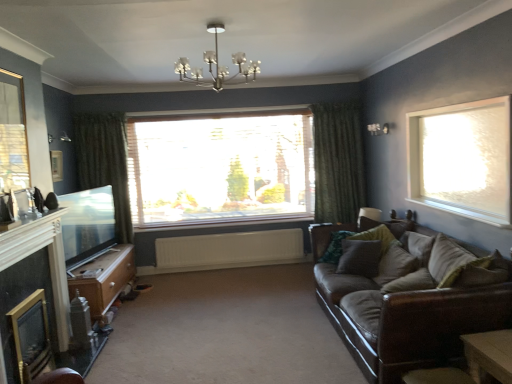
At what (x,y) coordinates should I click in order to perform the action: click on beige fabric pillow at right, which is the 3th pillow in back-to-front order. Please return your answer as a coordinate pair (x, y). Looking at the image, I should click on (395, 264).

The width and height of the screenshot is (512, 384). Describe the element at coordinates (87, 222) in the screenshot. I see `flat screen tv at left, the second window screen in the top-to-bottom sequence` at that location.

This screenshot has height=384, width=512. In order to click on frosted glass window at upper right, the second window from the left in this screenshot , I will do `click(462, 159)`.

Locate an element on the screen. This screenshot has height=384, width=512. wooden picture frame at upper left is located at coordinates (56, 165).

The image size is (512, 384). Find the location of `velvet green pillow at right, the first pillow when ordered from front to back`. velvet green pillow at right, the first pillow when ordered from front to back is located at coordinates (449, 261).

Based on the photo, is dark gray textured pillow at center right, acting as the 3th pillow starting from the front, closer to the viewer compared to green textured curtain at center, the 1th curtain when ordered from right to left?

Yes, dark gray textured pillow at center right, acting as the 3th pillow starting from the front, is in front of green textured curtain at center, the 1th curtain when ordered from right to left.

Is point (369, 274) more distant than point (345, 160)?

That is False.

Could you tell me if dark gray textured pillow at center right, acting as the 3th pillow starting from the front, is turned towards green textured curtain at center, the second curtain from the left?

No, dark gray textured pillow at center right, acting as the 3th pillow starting from the front, is not oriented towards green textured curtain at center, the second curtain from the left.

Based on the photo, which of these two, dark gray textured pillow at center right, which is counted as the second pillow, starting from the back, or green textured curtain at center, the 1th curtain when ordered from right to left, is bigger?

green textured curtain at center, the 1th curtain when ordered from right to left, is bigger.

What's the angular difference between brown leather couch at right and clear glass mirror at left, the second window screen positioned from the back,'s facing directions?

The angular difference between brown leather couch at right and clear glass mirror at left, the second window screen positioned from the back, is 179 degrees.

Considering their positions, is brown leather couch at right located in front of or behind clear glass mirror at left, which ranks as the 1th window screen in top-to-bottom order?

In the image, brown leather couch at right appears in front of clear glass mirror at left, which ranks as the 1th window screen in top-to-bottom order.

Is point (397, 221) behind point (7, 133)?

Yes, it is behind point (7, 133).

Would you say brown leather couch at right is a long distance from clear glass mirror at left, marked as the 1th window screen in a front-to-back arrangement?

brown leather couch at right is positioned a significant distance from clear glass mirror at left, marked as the 1th window screen in a front-to-back arrangement.

The width and height of the screenshot is (512, 384). In order to click on window screen lying in front of the flat screen tv at left, which appears as the 1th window screen when ordered from the bottom in this screenshot , I will do tap(13, 134).

Considering the relative positions of clear glass mirror at left, marked as the 1th window screen in a front-to-back arrangement, and flat screen tv at left, which appears as the 1th window screen when ordered from the bottom, in the image provided, is clear glass mirror at left, marked as the 1th window screen in a front-to-back arrangement, to the left of flat screen tv at left, which appears as the 1th window screen when ordered from the bottom, from the viewer's perspective?

Incorrect, clear glass mirror at left, marked as the 1th window screen in a front-to-back arrangement, is not on the left side of flat screen tv at left, which appears as the 1th window screen when ordered from the bottom.

Would you say flat screen tv at left, marked as the first window screen in a back-to-front arrangement, is part of clear glass mirror at left, which ranks as the 1th window screen in top-to-bottom order,'s contents?

No, flat screen tv at left, marked as the first window screen in a back-to-front arrangement, is not surrounded by clear glass mirror at left, which ranks as the 1th window screen in top-to-bottom order.

Is translucent wood window at center, the first window when ordered from back to front, at the back of wooden table at lower right?

wooden table at lower right does not have its back to translucent wood window at center, the first window when ordered from back to front.

Between wooden table at lower right and translucent wood window at center, which is counted as the first window, starting from the left, which one has smaller width?

translucent wood window at center, which is counted as the first window, starting from the left, is thinner.

Does point (511, 351) come in front of point (195, 149)?

Yes, it is.

From a real-world perspective, who is located lower, wooden table at lower right or translucent wood window at center, which is counted as the first window, starting from the left?

wooden table at lower right, from a real-world perspective.

Which object is further away from the camera taking this photo, wooden picture frame at upper left or dark gray textured pillow at center right, acting as the 3th pillow starting from the front?

wooden picture frame at upper left is more distant.

Which point is more forward, [55,173] or [367,254]?

Positioned in front is point [367,254].

Considering the sizes of objects wooden picture frame at upper left and dark gray textured pillow at center right, acting as the 3th pillow starting from the front, in the image provided, who is bigger, wooden picture frame at upper left or dark gray textured pillow at center right, acting as the 3th pillow starting from the front,?

With larger size is dark gray textured pillow at center right, acting as the 3th pillow starting from the front.

Measure the distance from beige fabric pillow at right, which is the 3th pillow in back-to-front order, to wooden table at lower right.

beige fabric pillow at right, which is the 3th pillow in back-to-front order, and wooden table at lower right are 3.71 feet apart from each other.

Is beige fabric pillow at right, which is the 3th pillow in back-to-front order, turned away from wooden table at lower right?

No.

Is wooden table at lower right located within beige fabric pillow at right, which is the 3th pillow in back-to-front order?

Actually, wooden table at lower right is outside beige fabric pillow at right, which is the 3th pillow in back-to-front order.

Who is taller, beige fabric pillow at right, which is the 3th pillow in back-to-front order, or wooden table at lower right?

With more height is beige fabric pillow at right, which is the 3th pillow in back-to-front order.

From a real-world perspective, which is physically below, beige fabric pillow at right, marked as the second pillow in a front-to-back arrangement, or clear glass mirror at left, which appears as the 2th window screen when ordered from the bottom?

beige fabric pillow at right, marked as the second pillow in a front-to-back arrangement.

In the scene shown: Can you confirm if beige fabric pillow at right, which is the 3th pillow in back-to-front order, is taller than clear glass mirror at left, which ranks as the 1th window screen in top-to-bottom order?

No.

Which object is further away from the camera, beige fabric pillow at right, marked as the second pillow in a front-to-back arrangement, or clear glass mirror at left, which appears as the 2th window screen when ordered from the bottom?

beige fabric pillow at right, marked as the second pillow in a front-to-back arrangement, is behind.

Can you confirm if beige fabric pillow at right, which is the 3th pillow in back-to-front order, is positioned to the right of clear glass mirror at left, marked as the 1th window screen in a front-to-back arrangement?

Yes.

Locate an element on the screen. The height and width of the screenshot is (384, 512). the 1st curtain located above the dark gray textured pillow at center right, which is counted as the second pillow, starting from the back (from a real-world perspective) is located at coordinates (338, 162).

Image resolution: width=512 pixels, height=384 pixels. I want to click on studio couch on the right of clear glass mirror at left, which appears as the 2th window screen when ordered from the bottom, so click(409, 299).

Considering their positions, is wooden picture frame at upper left positioned closer to metallic chandelier at upper center than velvet green pillow at right, the first pillow when ordered from front to back?

Based on the image, wooden picture frame at upper left appears to be nearer to metallic chandelier at upper center.

Based on their spatial positions, is beige fabric pillow at right, marked as the second pillow in a front-to-back arrangement, or clear glass mirror at left, the second window screen positioned from the back, closer to wooden picture frame at upper left?

Based on the image, clear glass mirror at left, the second window screen positioned from the back, appears to be nearer to wooden picture frame at upper left.

Considering their positions, is flat screen tv at left, the second window screen in the top-to-bottom sequence, positioned further to wooden table at lower right than wooden picture frame at upper left?

flat screen tv at left, the second window screen in the top-to-bottom sequence, is further to wooden table at lower right.

Looking at this image, looking at the image, which one is located closer to metallic chandelier at upper center, gold-framed glass fireplace at lower left or velvet green pillow at right, the first pillow when ordered from front to back?

gold-framed glass fireplace at lower left is closer to metallic chandelier at upper center.

Based on their spatial positions, is translucent wood window at center, the first window when ordered from back to front, or beige fabric pillow at right, which is the 3th pillow in back-to-front order, further from frosted glass window at upper right, the second window from the back?

Based on the image, translucent wood window at center, the first window when ordered from back to front, appears to be further to frosted glass window at upper right, the second window from the back.

In the scene shown: Considering their positions, is green fabric pillow at right, the 4th pillow in the front-to-back sequence, positioned further to velvet green pillow at right, the first pillow when ordered from front to back, than metallic chandelier at upper center?

metallic chandelier at upper center is positioned further to the anchor velvet green pillow at right, the first pillow when ordered from front to back.

Which object lies further to the anchor point frosted glass window at upper right, which is the 1th window in right-to-left order, clear glass mirror at left, which ranks as the 1th window screen in top-to-bottom order, or wooden entertainment center at lower left?

Among the two, clear glass mirror at left, which ranks as the 1th window screen in top-to-bottom order, is located further to frosted glass window at upper right, which is the 1th window in right-to-left order.

Looking at the image, which one is located closer to metallic chandelier at upper center, wooden entertainment center at lower left or frosted glass window at upper right, which is the 1th window in right-to-left order?

Based on the image, frosted glass window at upper right, which is the 1th window in right-to-left order, appears to be nearer to metallic chandelier at upper center.

Find the location of a particular element. The width and height of the screenshot is (512, 384). radiator between wooden entertainment center at lower left and green textured curtain at center, the 1th curtain when ordered from right to left, from left to right is located at coordinates pyautogui.click(x=229, y=250).

Where is `window between wooden entertainment center at lower left and dark gray textured pillow at center right, which is counted as the second pillow, starting from the back, from left to right`? window between wooden entertainment center at lower left and dark gray textured pillow at center right, which is counted as the second pillow, starting from the back, from left to right is located at coordinates (220, 167).

The width and height of the screenshot is (512, 384). Identify the location of entertainment center between wooden picture frame at upper left and green textured curtain at center, the second curtain from the left. (104, 279).

Where is `curtain between gold-framed glass fireplace at lower left and green textured curtain at center, the second curtain from the left, along the z-axis`? curtain between gold-framed glass fireplace at lower left and green textured curtain at center, the second curtain from the left, along the z-axis is located at coordinates (105, 162).